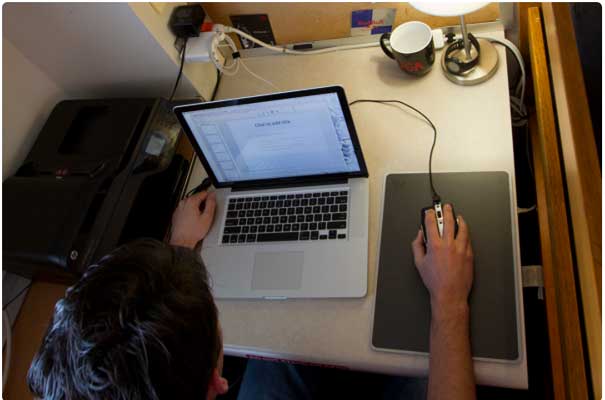
Identify the location of beige walls that meet in left corner. (36, 67), (76, 45), (16, 80).